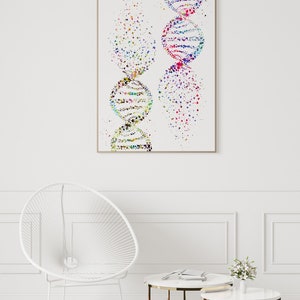
Where is `tables`? tables is located at coordinates (190, 285), (227, 296).